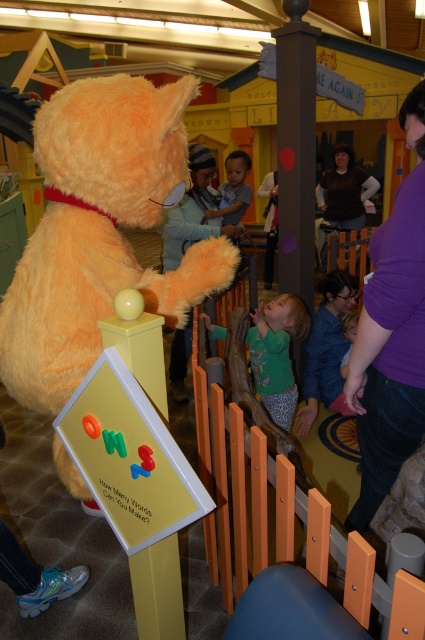
Question: Does fluffy orange teddy bear at left have a smaller size compared to green jersey at center?

Choices:
 (A) no
 (B) yes

Answer: (A)

Question: In this image, where is purple cotton shirt at upper right located relative to blue denim jeans at lower right?

Choices:
 (A) left
 (B) right

Answer: (A)

Question: Which point is closer to the camera?

Choices:
 (A) (220, 330)
 (B) (402, 364)
 (C) (129, 211)
 (D) (331, 188)

Answer: (B)

Question: Which of the following is the closest to the observer?

Choices:
 (A) (198, 200)
 (B) (269, 390)
 (C) (113, 243)

Answer: (C)

Question: Which object is positioned closest to the brown fabric shirt at center?

Choices:
 (A) green jersey at center
 (B) blue denim jeans at lower right
 (C) fluffy orange teddy bear at left

Answer: (B)

Question: Is purple cotton shirt at upper right wider than brown fabric shirt at center?

Choices:
 (A) no
 (B) yes

Answer: (A)